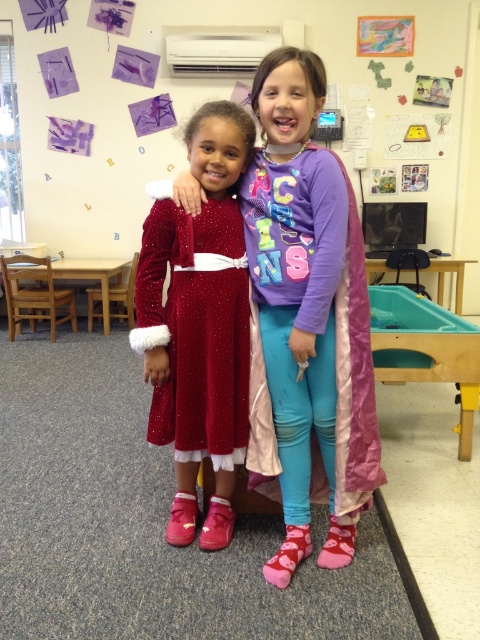
Question: Does velvet shiny dress at center have a larger size compared to pink satin cape at center?

Choices:
 (A) yes
 (B) no

Answer: (B)

Question: Considering the relative positions of velvet shiny dress at center and pink satin cape at center in the image provided, where is velvet shiny dress at center located with respect to pink satin cape at center?

Choices:
 (A) left
 (B) right

Answer: (A)

Question: Which point is closer to the camera?

Choices:
 (A) (231, 340)
 (B) (344, 460)

Answer: (A)

Question: Does velvet shiny dress at center have a smaller size compared to pink satin cape at center?

Choices:
 (A) yes
 (B) no

Answer: (A)